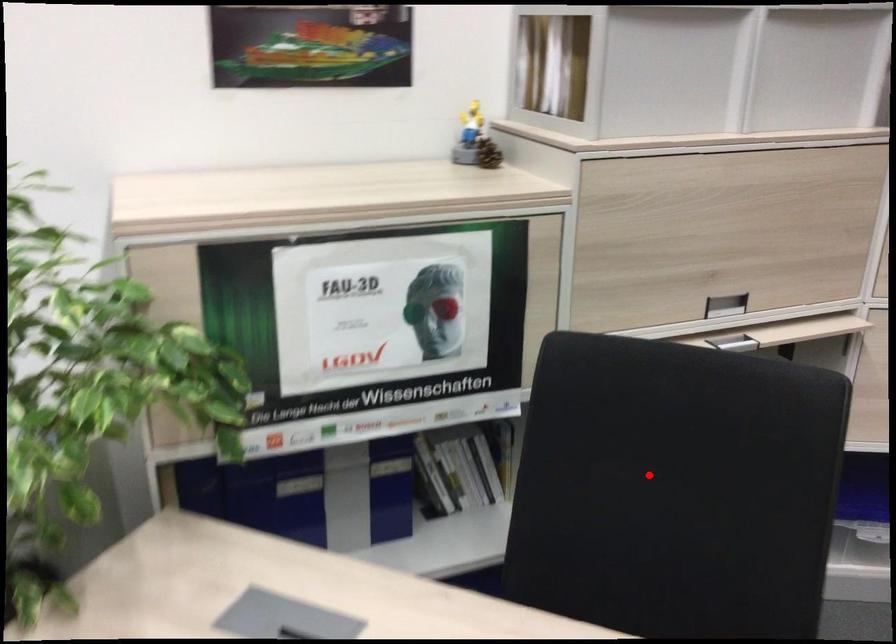
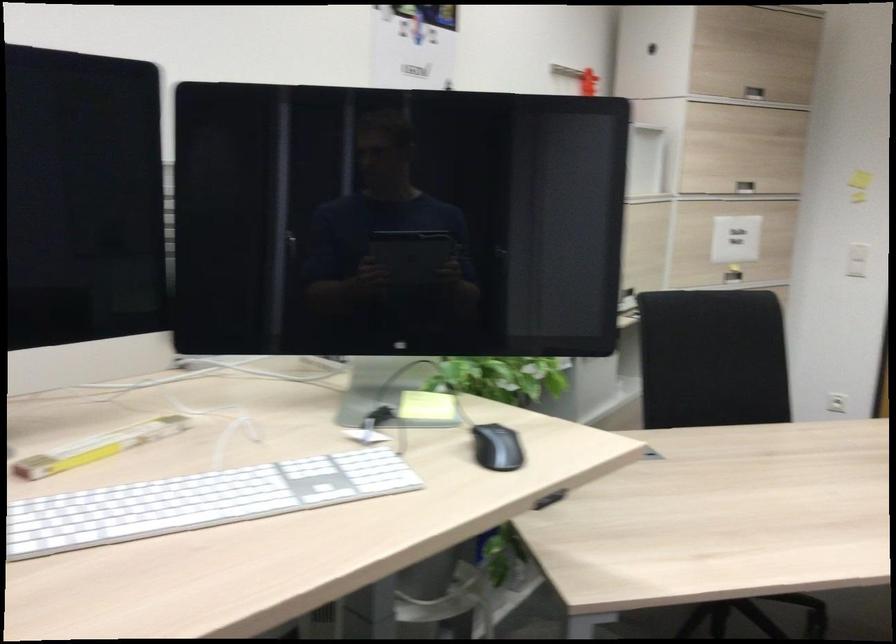
Find the pixel in the second image that matches the highlighted location in the first image.

(712, 359)